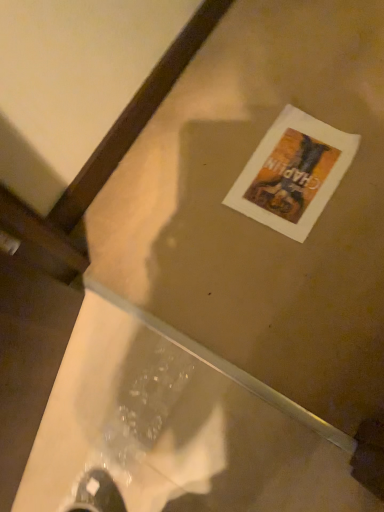
Locate an element on the screen. white paper book at center is located at coordinates (293, 173).

Describe the element at coordinates (293, 173) in the screenshot. I see `white paper book at center` at that location.

Where is `white paper book at center`? The height and width of the screenshot is (512, 384). white paper book at center is located at coordinates (293, 173).